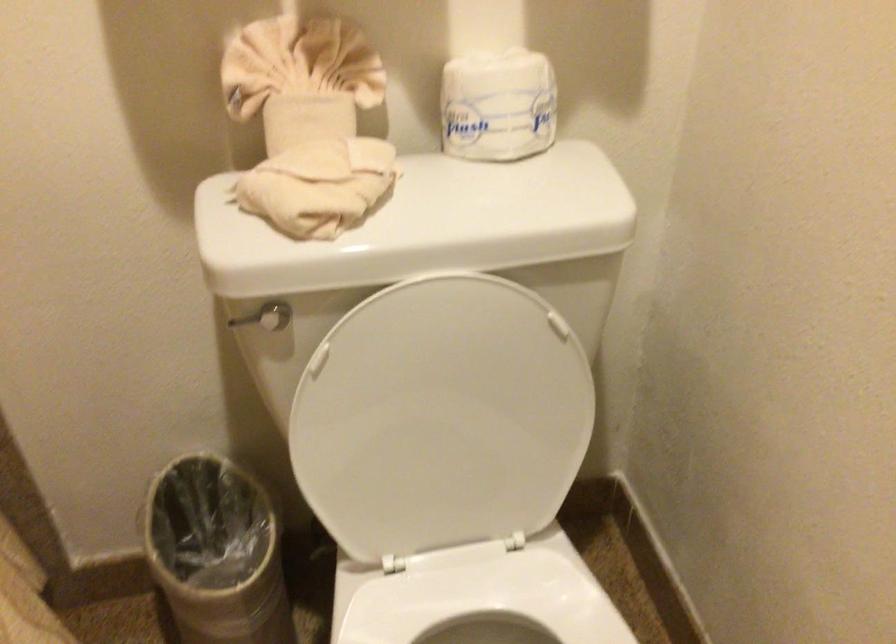
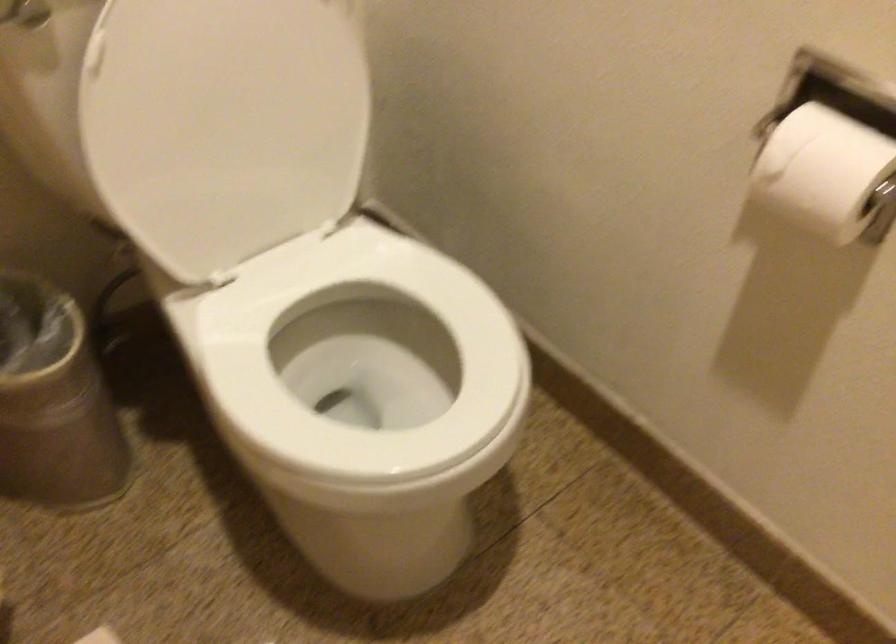
Find the pixel in the second image that matches [446,421] in the first image.

(239, 114)